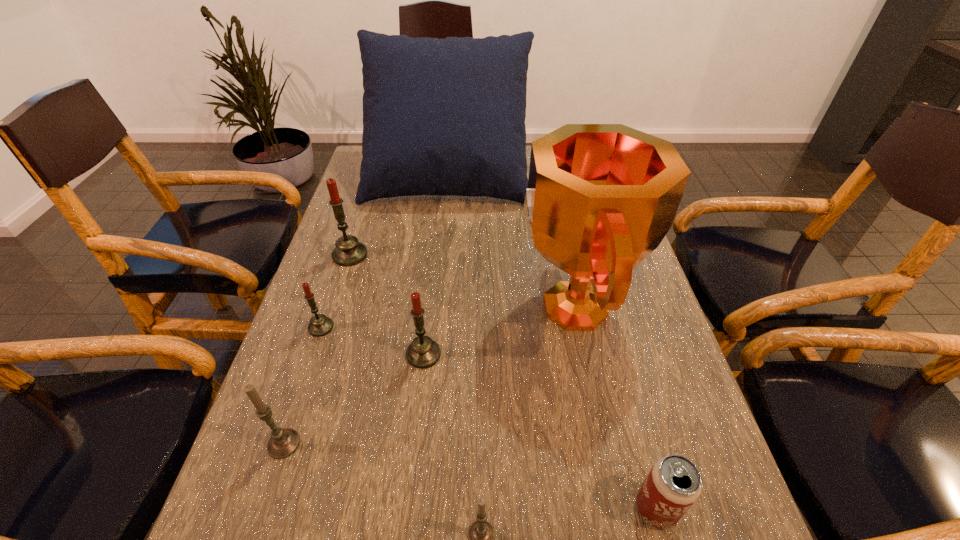
The height and width of the screenshot is (540, 960). In order to click on candle that is the closest to the award in this screenshot , I will do `click(423, 352)`.

Select which red candle appears as the second closest to the beer can. Please provide its 2D coordinates. Your answer should be formatted as a tuple, i.e. [(x, y)], where the tuple contains the x and y coordinates of a point satisfying the conditions above.

[(320, 325)]

Identify the location of red candle that is the third closest to the gold award. Image resolution: width=960 pixels, height=540 pixels. (320, 325).

The height and width of the screenshot is (540, 960). Identify the location of vacant space that satisfies the following two spatial constraints: 1. on the side of the beer can with the star emblem; 2. on the right side of the award. (613, 508).